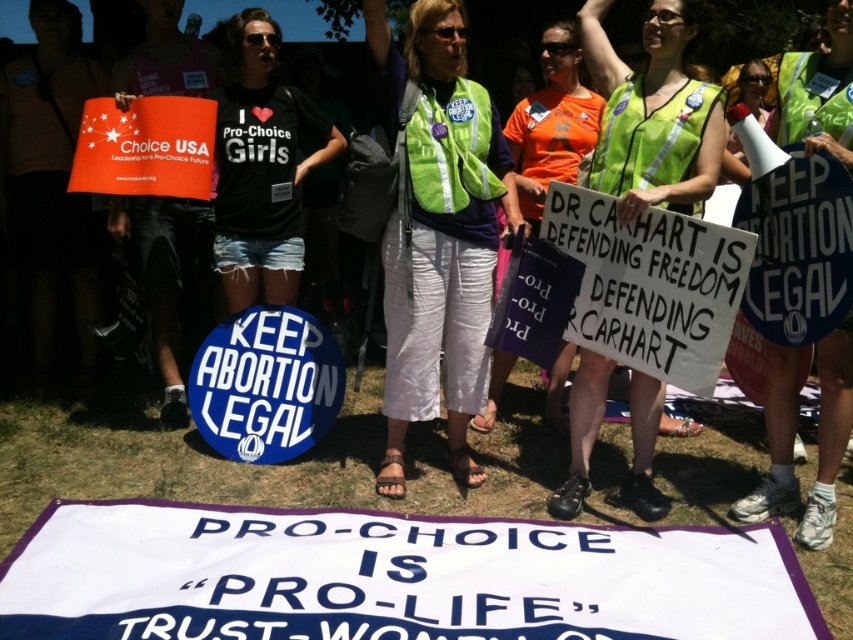
Question: Can you confirm if green reflective vest at center is thinner than neon green safety vest at center?

Choices:
 (A) no
 (B) yes

Answer: (A)

Question: Among these objects, which one is nearest to the camera?

Choices:
 (A) neon green safety vest at center
 (B) green reflective vest at center

Answer: (A)

Question: Is green reflective vest at center closer to camera compared to neon green safety vest at center?

Choices:
 (A) yes
 (B) no

Answer: (B)

Question: Which point is closer to the camera?

Choices:
 (A) (648, 481)
 (B) (474, 180)

Answer: (A)

Question: In this image, where is green reflective vest at center located relative to neon green safety vest at center?

Choices:
 (A) above
 (B) below

Answer: (B)